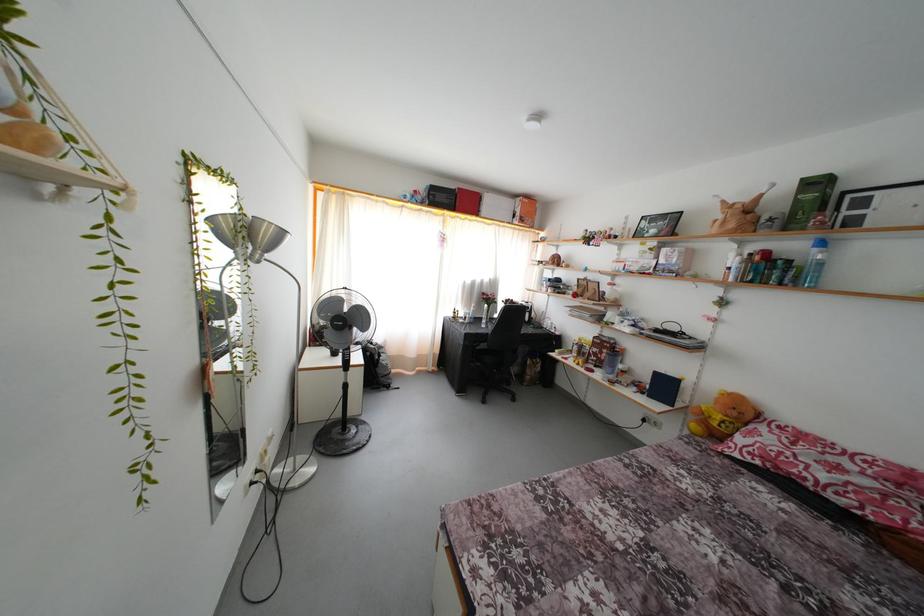
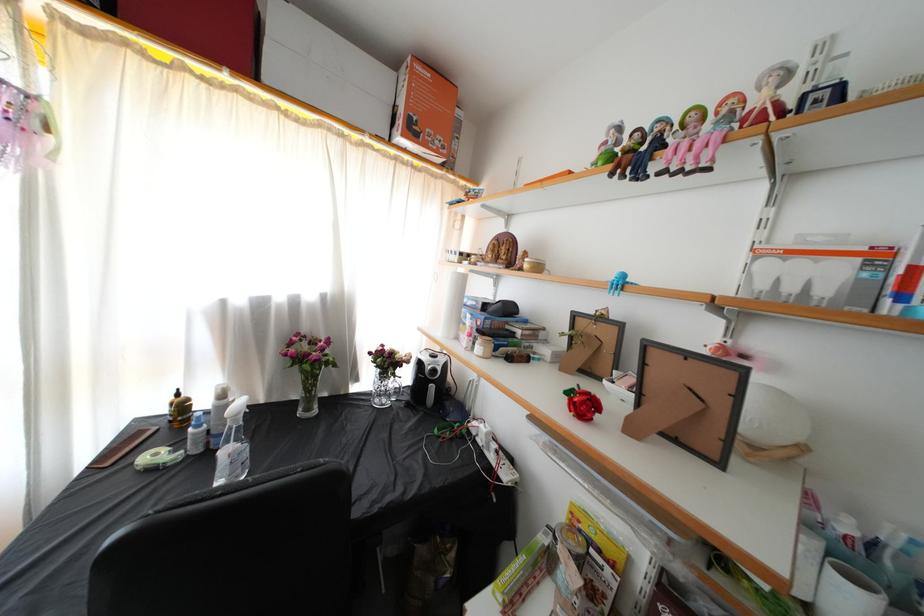
In the second image, find the point that corresponds to pixel 527 225 in the first image.

(418, 137)